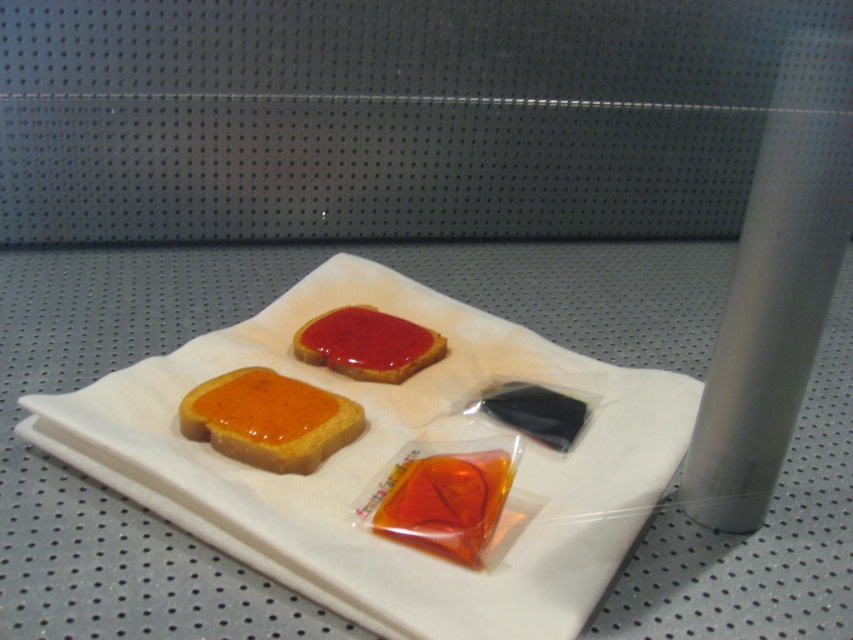
You are a customer looking at the toast arrangement on the display. Which toast is placed below the other between the matte orange toast at center and the matte red toast at center?

The matte orange toast at center is positioned under the matte red toast at center, so the orange one is below the red one.

You are arranging a breakfast display and have two toasts, the matte orange toast at center and the matte red toast at center. Which one should you place on the left side to match the image?

The matte orange toast at center should be placed on the left side because it is positioned on the left side of the matte red toast at center in the image.